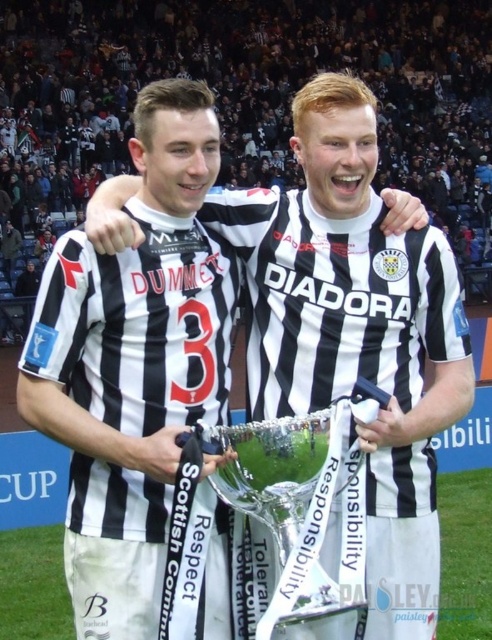
You are a photographer standing in front of the two individuals holding the trophy. You notice two points marked on the image at coordinates point (109, 468) and point (13, 538). Which point is closer to you?

Point (109, 468) is closer to the viewer than point (13, 538).

You are a photographer standing at the edge of the sports field. You need to position yourself so that both the black and white jersey at center and the trophy they are holding are clearly visible in your shot. Based on their positions, where should you aim your camera?

The black and white jersey at center is located at point (133,364), so you should aim your camera towards that position to ensure both the jersey and the trophy they are holding are in frame.

You are a photographer at the event and want to capture a photo where the black and white jersey at center and the green grass at center are both visible. Based on their positions, will the jersey block the view of the grass in the photo?

The black and white jersey at center is above green grass at center, so the jersey will block part of the grass in the photo.